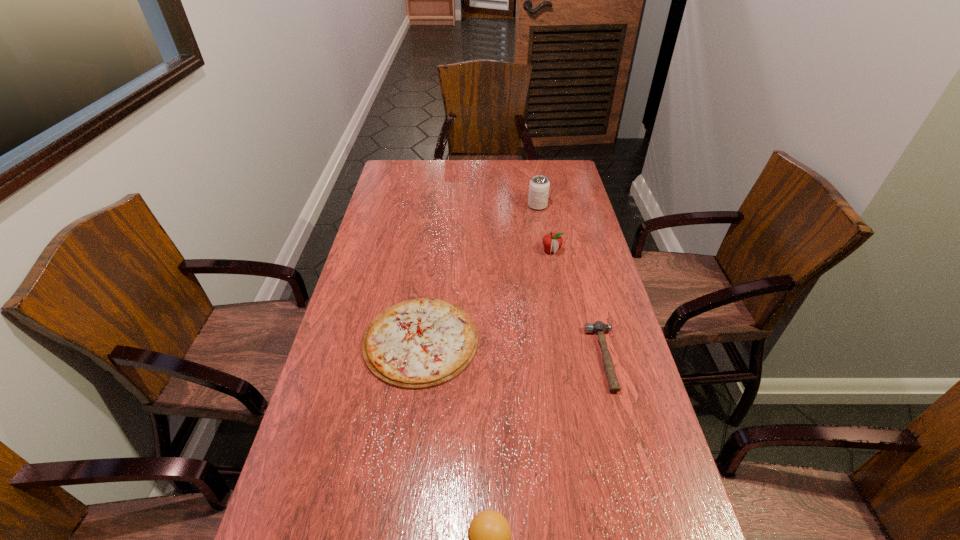
This screenshot has height=540, width=960. Identify the location of the tallest object. (539, 185).

Find the location of a particular element. This screenshot has width=960, height=540. soda can is located at coordinates pyautogui.click(x=539, y=185).

The width and height of the screenshot is (960, 540). In order to click on apple in this screenshot , I will do `click(552, 242)`.

Where is `the second shortest object`? The image size is (960, 540). the second shortest object is located at coordinates pyautogui.click(x=598, y=327).

I want to click on the rightmost object, so click(x=598, y=327).

Where is `pizza`? pizza is located at coordinates (420, 343).

I want to click on vacant space located on the front of the soda can, so click(540, 223).

This screenshot has width=960, height=540. Identify the location of free point located 0.190m on the left of the fourth nearest object. (489, 251).

Find the location of a particular element. vacant space positioned on the striking face of the rightmost object is located at coordinates (559, 358).

Identify the location of free space located 0.050m on the striking face of the rightmost object. (573, 358).